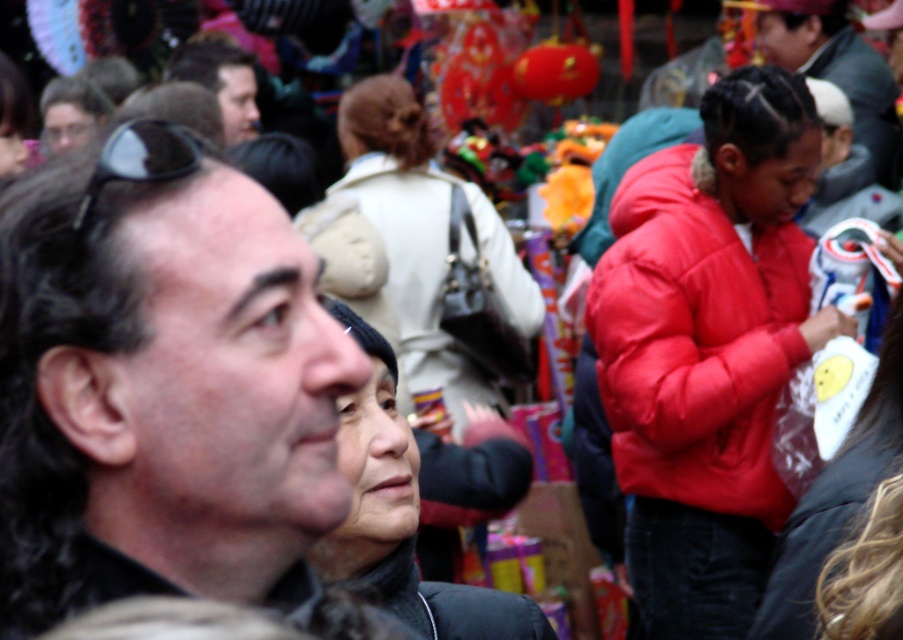
Question: From the image, what is the correct spatial relationship of black fabric jacket at center in relation to dark brown hair at upper right?

Choices:
 (A) below
 (B) above

Answer: (A)

Question: Does black fabric jacket at center appear on the left side of black matte sunglasses at upper left?

Choices:
 (A) no
 (B) yes

Answer: (A)

Question: Which of the following is the closest to the observer?

Choices:
 (A) (408, 173)
 (B) (105, 96)
 (C) (166, 136)
 (D) (618, 200)

Answer: (C)

Question: Based on their relative distances, which object is farther from the dark brown hair at center?

Choices:
 (A) matte black sunglasses at upper left
 (B) dark brown hair at upper right

Answer: (A)

Question: Can you confirm if dark brown hair at center is smaller than black fabric jacket at center?

Choices:
 (A) yes
 (B) no

Answer: (B)

Question: Which point is closer to the camera?

Choices:
 (A) dark brown hair at center
 (B) dark brown hair at upper right
 (C) matte red jacket at right

Answer: (A)